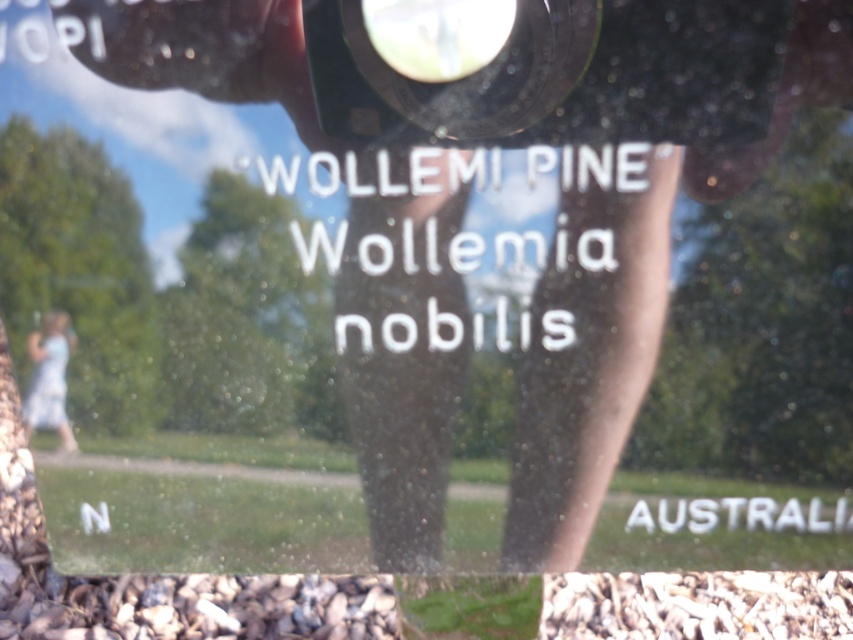
Question: Is black plastic lens at upper center above light blue fabric dress at lower left?

Choices:
 (A) no
 (B) yes

Answer: (B)

Question: Which of the following is the farthest from the observer?

Choices:
 (A) (36, 419)
 (B) (496, 72)

Answer: (A)

Question: Is black plastic lens at upper center further to the viewer compared to light blue fabric dress at lower left?

Choices:
 (A) yes
 (B) no

Answer: (B)

Question: Is black plastic lens at upper center thinner than light blue fabric dress at lower left?

Choices:
 (A) no
 (B) yes

Answer: (A)